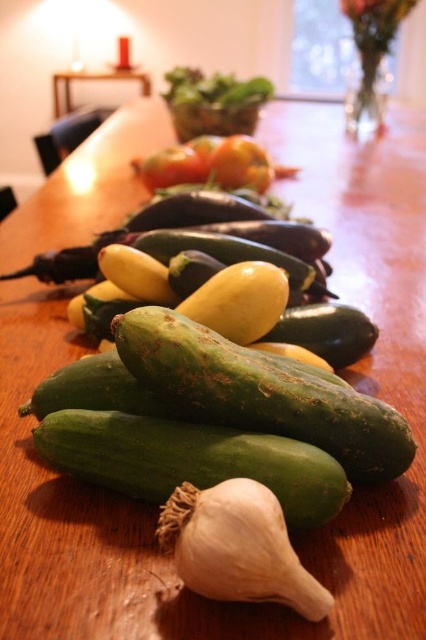
Between green matte cucumber at center and smooth orange squash at center, which one appears on the left side from the viewer's perspective?

From the viewer's perspective, green matte cucumber at center appears more on the left side.

Who is more distant from viewer, (271,474) or (207,156)?

Positioned behind is point (207,156).

Where is `green matte cucumber at center`? green matte cucumber at center is located at coordinates (x=190, y=460).

Is smooth orange squash at center wider than wooden table at upper center?

No.

Is smooth orange squash at center thinner than wooden table at upper center?

Yes.

Who is more forward, (291, 176) or (146, 90)?

Point (291, 176) is in front.

You are a GUI agent. You are given a task and a screenshot of the screen. Output one action in this format:
    pyautogui.click(x=<x>, y=<y>)
    Task: Click on the smooth orange squash at center
    This screenshot has height=640, width=426.
    Given the screenshot: What is the action you would take?
    pyautogui.click(x=212, y=164)

Is green matte cucumber at center positioned before white matte garlic at lower center?

No.

Is green matte cucumber at center smaller than white matte garlic at lower center?

No, green matte cucumber at center is not smaller than white matte garlic at lower center.

Consider the image. Measure the distance between point (x=175, y=433) and camera.

They are 37.07 inches apart.

In order to click on green matte cucumber at center in this screenshot , I will do `click(190, 460)`.